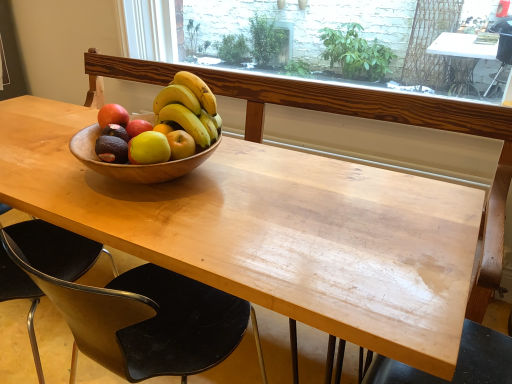
Question: Is matte brown avocado at center bigger than black plastic chair at lower right, the third chair positioned from the left?

Choices:
 (A) no
 (B) yes

Answer: (A)

Question: Is the surface of matte brown avocado at center in direct contact with black plastic chair at lower right, which is the 1th chair from right to left?

Choices:
 (A) no
 (B) yes

Answer: (A)

Question: Is the depth of matte brown avocado at center less than that of black plastic chair at lower right, which is the 1th chair from right to left?

Choices:
 (A) yes
 (B) no

Answer: (B)

Question: Is matte brown avocado at center turned away from black plastic chair at lower right, the third chair positioned from the left?

Choices:
 (A) no
 (B) yes

Answer: (A)

Question: Can you confirm if matte brown avocado at center is wider than black plastic chair at lower right, the third chair positioned from the left?

Choices:
 (A) no
 (B) yes

Answer: (A)

Question: Relative to black plastic chair at lower right, which is the 1th chair from right to left, is yellow matte bananas at center in front or behind?

Choices:
 (A) behind
 (B) front

Answer: (A)

Question: From a real-world perspective, is yellow matte bananas at center physically located above or below black plastic chair at lower right, which is the 1th chair from right to left?

Choices:
 (A) above
 (B) below

Answer: (A)

Question: Is point (202, 137) closer or farther from the camera than point (430, 379)?

Choices:
 (A) farther
 (B) closer

Answer: (A)

Question: Is yellow matte bananas at center taller or shorter than black plastic chair at lower right, which is the 1th chair from right to left?

Choices:
 (A) tall
 (B) short

Answer: (B)

Question: Considering the positions of black plastic chair at lower left, placed as the third chair when sorted from right to left, and yellow matte bananas at center in the image, is black plastic chair at lower left, placed as the third chair when sorted from right to left, taller or shorter than yellow matte bananas at center?

Choices:
 (A) tall
 (B) short

Answer: (A)

Question: Is black plastic chair at lower left, placed as the third chair when sorted from right to left, inside or outside of yellow matte bananas at center?

Choices:
 (A) inside
 (B) outside

Answer: (B)

Question: In terms of size, does black plastic chair at lower left, the 1th chair positioned from the left, appear bigger or smaller than yellow matte bananas at center?

Choices:
 (A) big
 (B) small

Answer: (A)

Question: Is point click(x=9, y=264) positioned closer to the camera than point click(x=187, y=130)?

Choices:
 (A) farther
 (B) closer

Answer: (A)

Question: From a real-world perspective, relative to matte brown avocado at center, is yellow matte bananas at center vertically above or below?

Choices:
 (A) below
 (B) above

Answer: (B)

Question: Which is correct: yellow matte bananas at center is inside matte brown avocado at center, or outside of it?

Choices:
 (A) outside
 (B) inside

Answer: (A)